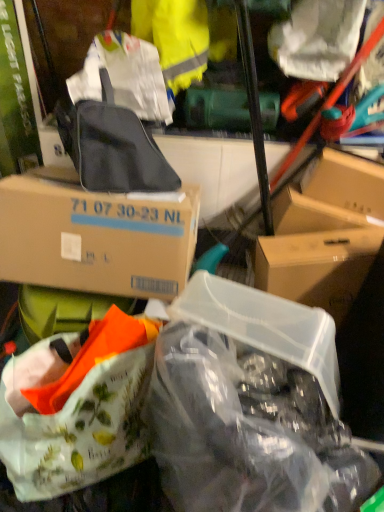
Question: Is yellow fabric at upper center smaller than white matte plastic bag at upper right, which is the second plastic bag in bottom-to-top order?

Choices:
 (A) no
 (B) yes

Answer: (A)

Question: Can you confirm if yellow fabric at upper center is positioned to the left of white matte plastic bag at upper right, which is the second plastic bag in bottom-to-top order?

Choices:
 (A) yes
 (B) no

Answer: (A)

Question: Can you confirm if yellow fabric at upper center is thinner than white matte plastic bag at upper right, positioned as the first plastic bag in top-to-bottom order?

Choices:
 (A) yes
 (B) no

Answer: (B)

Question: Is yellow fabric at upper center closer to the viewer compared to white matte plastic bag at upper right, which is the second plastic bag in bottom-to-top order?

Choices:
 (A) no
 (B) yes

Answer: (A)

Question: Is yellow fabric at upper center taller than white matte plastic bag at upper right, which is the second plastic bag in bottom-to-top order?

Choices:
 (A) no
 (B) yes

Answer: (B)

Question: Relative to brown cardboard box at upper left, marked as the 2th box in a right-to-left arrangement, is yellow fabric at upper center in front or behind?

Choices:
 (A) front
 (B) behind

Answer: (B)

Question: Is yellow fabric at upper center taller or shorter than brown cardboard box at upper left, the first box from the left?

Choices:
 (A) short
 (B) tall

Answer: (B)

Question: Which is correct: yellow fabric at upper center is inside brown cardboard box at upper left, marked as the 2th box in a right-to-left arrangement, or outside of it?

Choices:
 (A) inside
 (B) outside

Answer: (B)

Question: From the image's perspective, is yellow fabric at upper center located above or below brown cardboard box at upper left, marked as the 2th box in a right-to-left arrangement?

Choices:
 (A) below
 (B) above

Answer: (B)

Question: In terms of width, does transparent plastic bag at center, which appears as the 2th plastic bag when viewed from the top, look wider or thinner when compared to transparent plastic container at center-right, which is the 1th box in right-to-left order?

Choices:
 (A) thin
 (B) wide

Answer: (B)

Question: Is transparent plastic bag at center, which appears as the 2th plastic bag when viewed from the top, in front of or behind transparent plastic container at center-right, the second box when ordered from left to right, in the image?

Choices:
 (A) front
 (B) behind

Answer: (A)

Question: In terms of size, does transparent plastic bag at center, which appears as the 2th plastic bag when viewed from the top, appear bigger or smaller than transparent plastic container at center-right, which is the 1th box in right-to-left order?

Choices:
 (A) small
 (B) big

Answer: (B)

Question: Is transparent plastic bag at center, which appears as the 2th plastic bag when viewed from the top, inside the boundaries of transparent plastic container at center-right, the second box when ordered from left to right, or outside?

Choices:
 (A) outside
 (B) inside

Answer: (A)

Question: Is point (56, 446) positioned closer to the camera than point (117, 118)?

Choices:
 (A) farther
 (B) closer

Answer: (B)

Question: From the image's perspective, is white fabric handbag at lower left located above or below matte black backpack at upper center?

Choices:
 (A) below
 (B) above

Answer: (A)